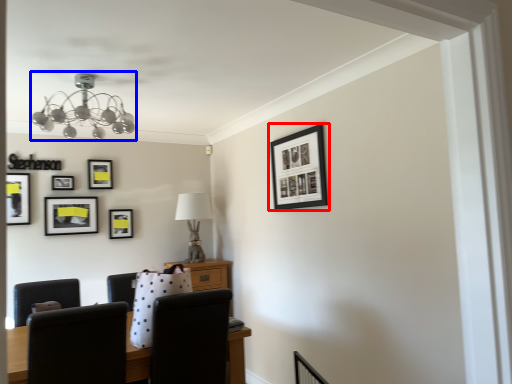
Question: Which point is closer to the camera, picture frame (highlighted by a red box) or lamp (highlighted by a blue box)?

Choices:
 (A) picture frame
 (B) lamp

Answer: (B)